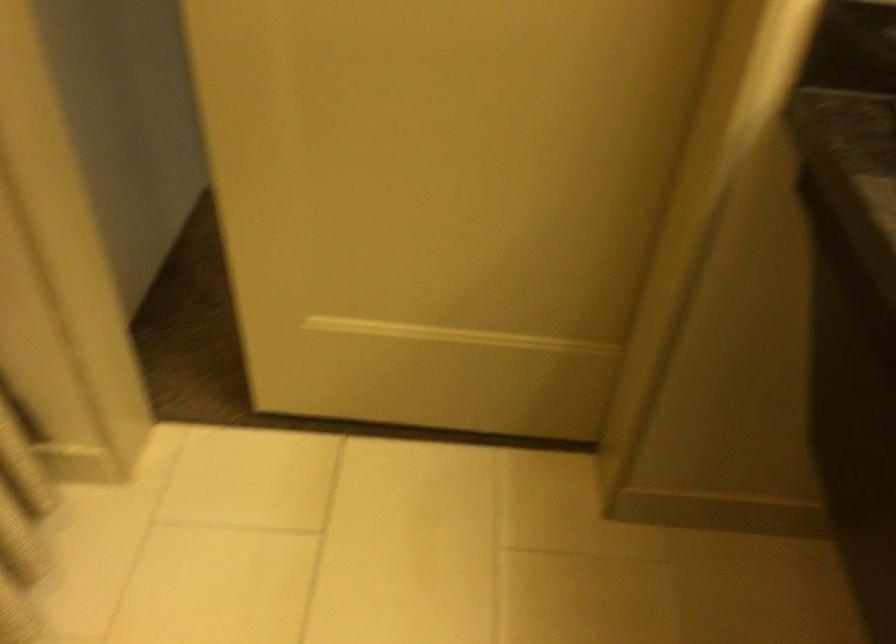
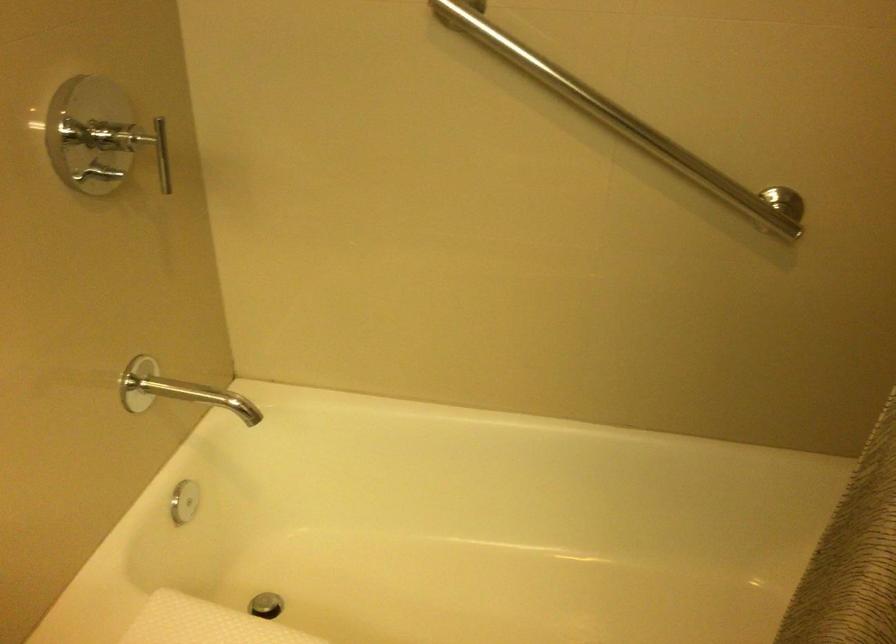
The first image is from the beginning of the video and the second image is from the end. How did the camera likely rotate when shooting the video?

The camera's rotation is toward left-down.